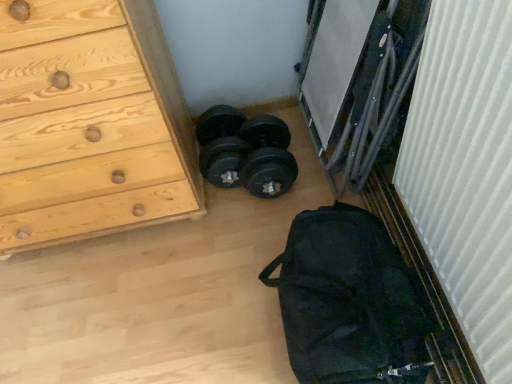
Question: Is white ribbed curtain at right positioned behind natural wood chest of drawers at left?

Choices:
 (A) no
 (B) yes

Answer: (A)

Question: Is white ribbed curtain at right completely or partially outside of natural wood chest of drawers at left?

Choices:
 (A) no
 (B) yes

Answer: (B)

Question: Could you tell me if white ribbed curtain at right is facing natural wood chest of drawers at left?

Choices:
 (A) no
 (B) yes

Answer: (B)

Question: Can you confirm if white ribbed curtain at right is thinner than natural wood chest of drawers at left?

Choices:
 (A) yes
 (B) no

Answer: (A)

Question: Does white ribbed curtain at right come in front of natural wood chest of drawers at left?

Choices:
 (A) yes
 (B) no

Answer: (A)

Question: From a real-world perspective, is white ribbed curtain at right above or below black fabric bag at lower right?

Choices:
 (A) above
 (B) below

Answer: (A)

Question: Would you say white ribbed curtain at right is inside or outside black fabric bag at lower right?

Choices:
 (A) outside
 (B) inside

Answer: (A)

Question: Considering the positions of white ribbed curtain at right and black fabric bag at lower right in the image, is white ribbed curtain at right taller or shorter than black fabric bag at lower right?

Choices:
 (A) tall
 (B) short

Answer: (A)

Question: Is point (415, 183) closer or farther from the camera than point (373, 223)?

Choices:
 (A) closer
 (B) farther

Answer: (A)

Question: Considering the positions of black rubber dumbbells at center and natural wood chest of drawers at left in the image, is black rubber dumbbells at center taller or shorter than natural wood chest of drawers at left?

Choices:
 (A) tall
 (B) short

Answer: (B)

Question: From the image's perspective, is black rubber dumbbells at center above or below natural wood chest of drawers at left?

Choices:
 (A) below
 (B) above

Answer: (A)

Question: Looking at their shapes, would you say black rubber dumbbells at center is wider or thinner than natural wood chest of drawers at left?

Choices:
 (A) thin
 (B) wide

Answer: (A)

Question: Visually, is black rubber dumbbells at center positioned to the left or to the right of natural wood chest of drawers at left?

Choices:
 (A) right
 (B) left

Answer: (A)

Question: Is black fabric bag at lower right inside the boundaries of natural wood chest of drawers at left, or outside?

Choices:
 (A) outside
 (B) inside

Answer: (A)

Question: From a real-world perspective, is black fabric bag at lower right positioned above or below natural wood chest of drawers at left?

Choices:
 (A) above
 (B) below

Answer: (B)